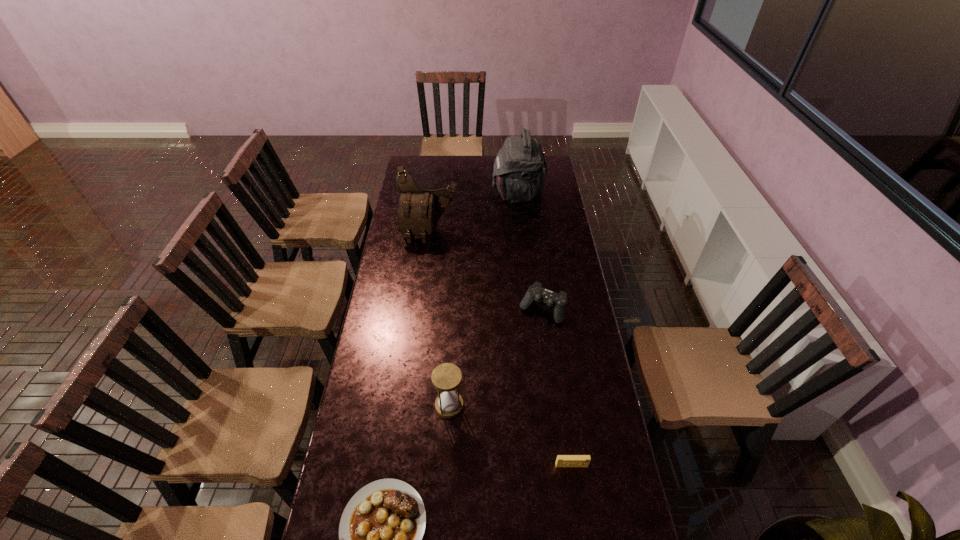
Locate an element on the screen. The width and height of the screenshot is (960, 540). vacant space that is in between the third tallest object and the farthest object is located at coordinates (484, 299).

Find the location of a particular element. The height and width of the screenshot is (540, 960). vacant region between the control and the fourth farthest object is located at coordinates (495, 357).

Identify which object is the third closest to the nearer shoulder bag. Please provide its 2D coordinates. Your answer should be formatted as a tuple, i.e. [(x, y)], where the tuple contains the x and y coordinates of a point satisfying the conditions above.

[(446, 377)]

Image resolution: width=960 pixels, height=540 pixels. I want to click on the fifth closest object to the farther shoulder bag, so click(380, 533).

Image resolution: width=960 pixels, height=540 pixels. Find the location of `free point that satisfies the following two spatial constraints: 1. on the open flap of the farthest object; 2. on the front side of the fourth shortest object`. free point that satisfies the following two spatial constraints: 1. on the open flap of the farthest object; 2. on the front side of the fourth shortest object is located at coordinates (540, 406).

Where is `free space that satisfies the following two spatial constraints: 1. on the back side of the fourth tallest object; 2. on the open flap of the right shoulder bag`? This screenshot has width=960, height=540. free space that satisfies the following two spatial constraints: 1. on the back side of the fourth tallest object; 2. on the open flap of the right shoulder bag is located at coordinates (527, 193).